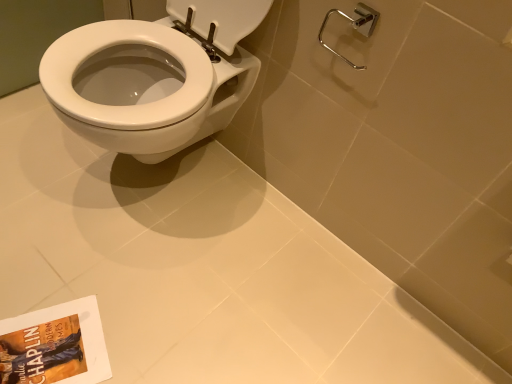
You are a GUI agent. You are given a task and a screenshot of the screen. Output one action in this format:
    pyautogui.click(x=<x>, y=<y>)
    Task: Click on the vacant space to the right of matte paper book at lower left
    This screenshot has height=384, width=512.
    Given the screenshot: What is the action you would take?
    pyautogui.click(x=144, y=340)